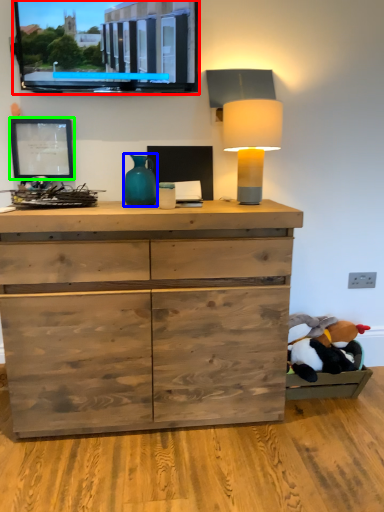
Question: Considering the real-world distances, which object is closest to computer monitor (highlighted by a red box)? vase (highlighted by a blue box) or picture frame (highlighted by a green box).

Choices:
 (A) vase
 (B) picture frame

Answer: (B)